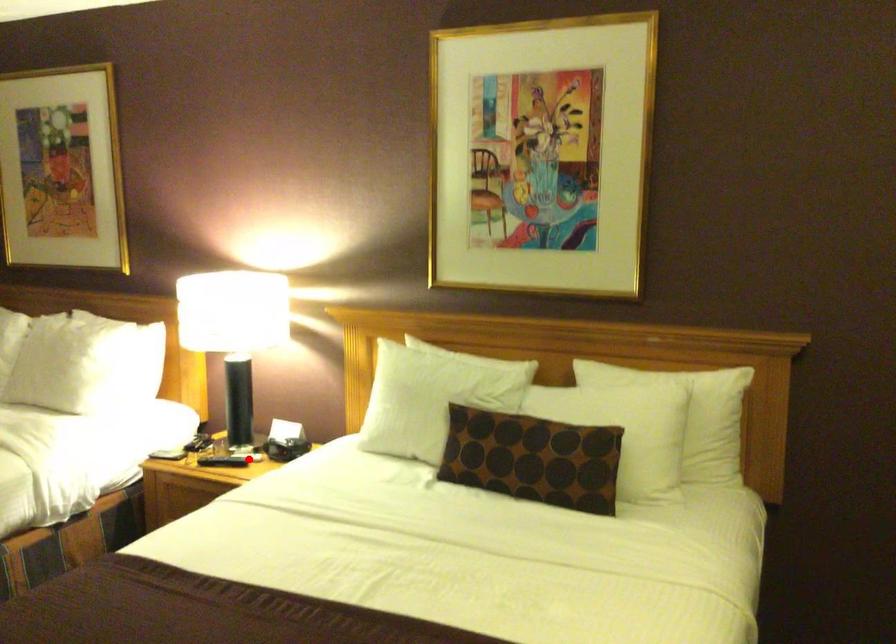
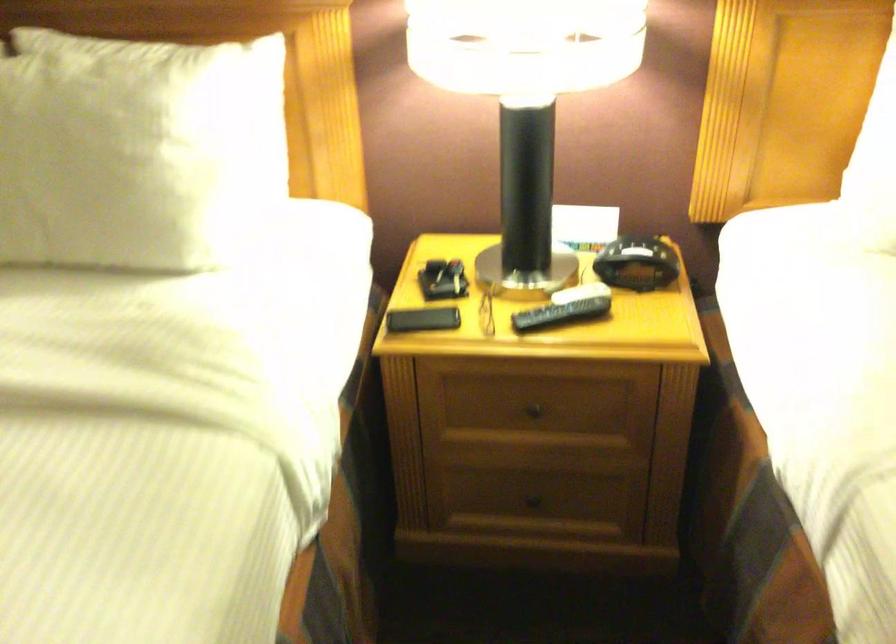
In the second image, find the point that corresponds to the highlighted location in the first image.

(579, 292)